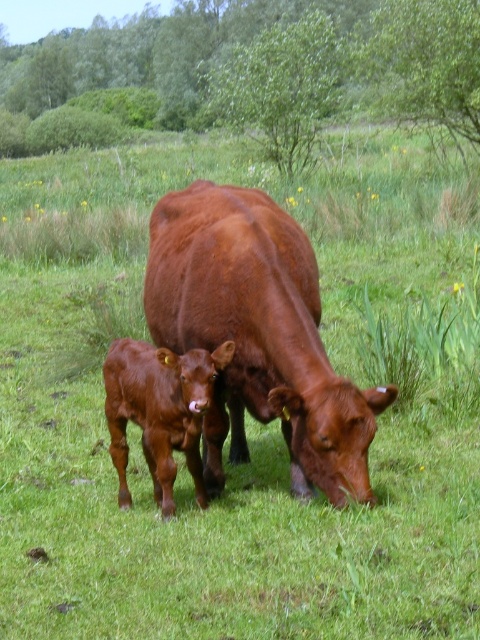
Question: Among these points, which one is nearest to the camera?

Choices:
 (A) (180, 444)
 (B) (319, 410)

Answer: (B)

Question: From the image, what is the correct spatial relationship of shiny brown cow at center in relation to smooth brown calf at center?

Choices:
 (A) left
 (B) right

Answer: (B)

Question: Among these objects, which one is farthest from the camera?

Choices:
 (A) shiny brown cow at center
 (B) smooth brown calf at center

Answer: (B)

Question: Is shiny brown cow at center to the right of smooth brown calf at center from the viewer's perspective?

Choices:
 (A) no
 (B) yes

Answer: (B)

Question: Is the position of shiny brown cow at center less distant than that of smooth brown calf at center?

Choices:
 (A) no
 (B) yes

Answer: (B)

Question: Which point is closer to the camera taking this photo?

Choices:
 (A) (108, 349)
 (B) (176, 342)

Answer: (B)